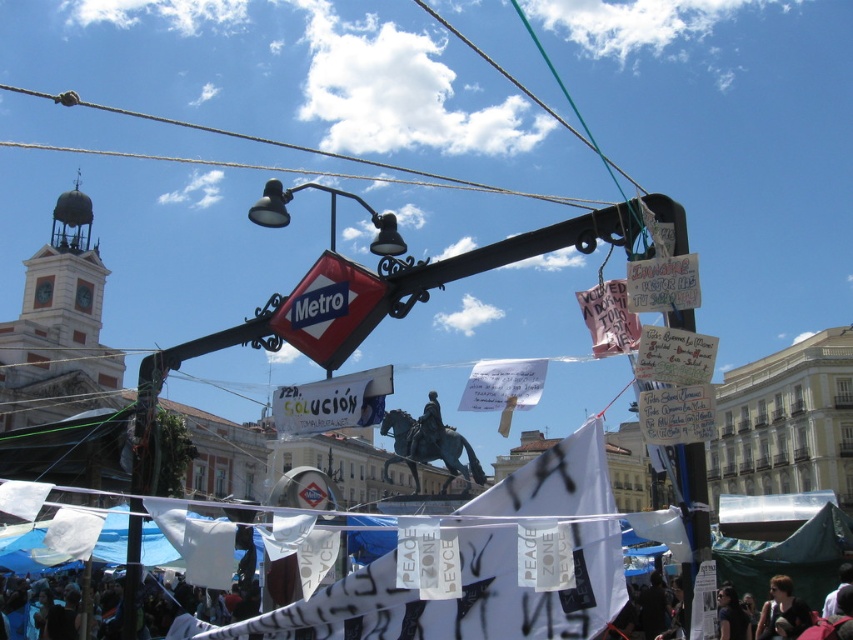
Question: Which object appears farthest from the camera in this image?

Choices:
 (A) red plastic metro sign at center
 (B) black fabric crowd at lower left
 (C) blonde hair at lower right

Answer: (C)

Question: Can you confirm if black fabric crowd at lower left is thinner than bronze statue of a man on horseback at center?

Choices:
 (A) yes
 (B) no

Answer: (B)

Question: Which of the following is the closest to the observer?

Choices:
 (A) pyautogui.click(x=170, y=612)
 (B) pyautogui.click(x=730, y=588)

Answer: (B)

Question: Which point is farther to the camera?

Choices:
 (A) (10, 589)
 (B) (320, 292)
 (C) (722, 625)

Answer: (A)

Question: Is blonde hair at lower right bigger than bronze statue of a man on horseback at center?

Choices:
 (A) no
 (B) yes

Answer: (A)

Question: Can you confirm if red plastic metro sign at center is wider than dark hair at lower right?

Choices:
 (A) no
 (B) yes

Answer: (B)